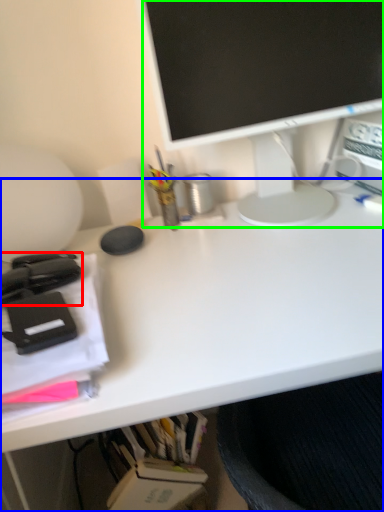
Question: Which is nearer to the office supplies (highlighted by a red box)? desk (highlighted by a blue box) or television (highlighted by a green box).

Choices:
 (A) desk
 (B) television

Answer: (A)